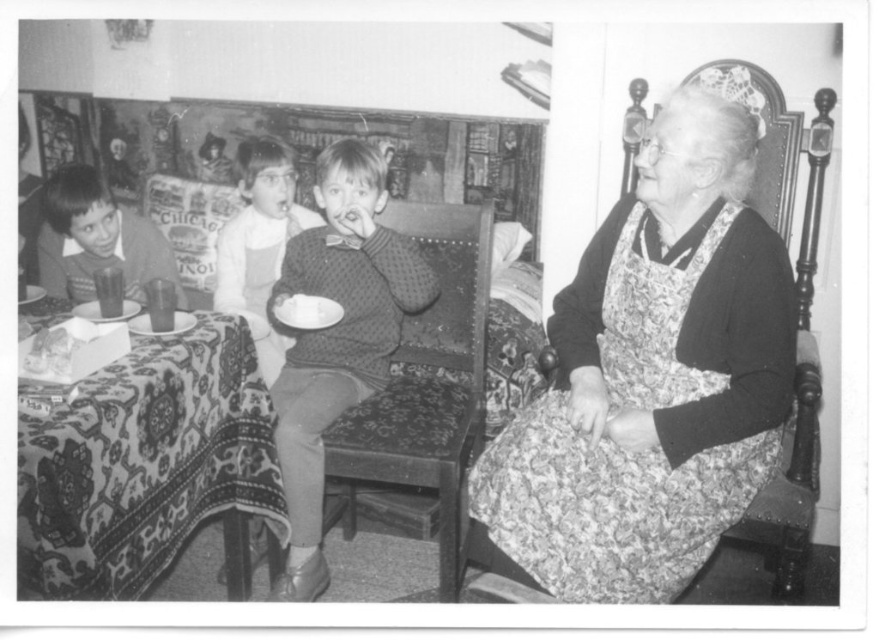
Question: Which point is closer to the camera?

Choices:
 (A) knitted sweater at center
 (B) smooth plastic cup at left
 (C) white fluffy cake at center

Answer: (A)

Question: Is smooth white cake at lower left bigger than white fluffy cake at center?

Choices:
 (A) yes
 (B) no

Answer: (B)

Question: Which object is positioned closest to the smooth sweater at center?

Choices:
 (A) knitted sweater at center
 (B) floral-patterned dress at right

Answer: (A)

Question: Which point is closer to the camera?

Choices:
 (A) (282, 308)
 (B) (378, 209)
 (C) (51, 353)
 (D) (260, 310)

Answer: (C)

Question: Does smooth plastic cup at left have a lesser width compared to smooth white cake at lower left?

Choices:
 (A) yes
 (B) no

Answer: (B)

Question: Where is floral-patterned dress at right located in relation to smooth sweater at center in the image?

Choices:
 (A) above
 (B) below

Answer: (B)